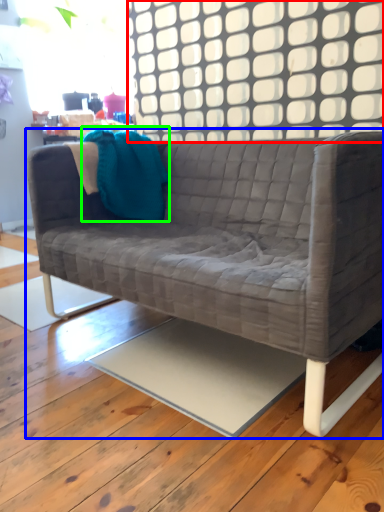
Question: Estimate the real-world distances between objects in this image. Which object is closer to window (highlighted by a red box), studio couch (highlighted by a blue box) or throw pillow (highlighted by a green box)?

Choices:
 (A) studio couch
 (B) throw pillow

Answer: (B)